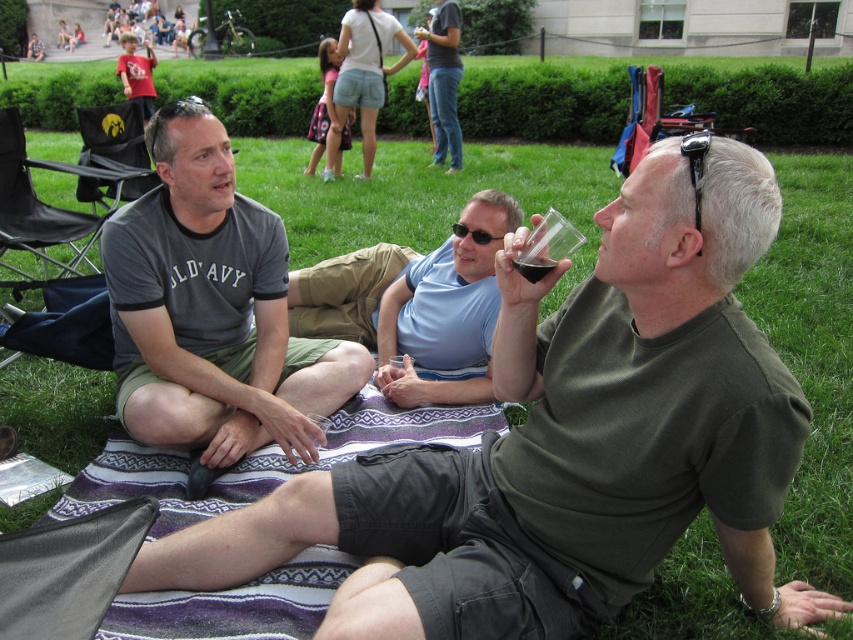
Based on the coordinates provided, which object is located at point (596, 422)?

The point (596, 422) corresponds to the matte green t shirt at center.

You are a photographer standing at the edge of the grassy area. You want to take a photo of the black rubber sunglasses at upper right and the dark glass at center. Which object should you focus on first to ensure both are in sharp focus?

The black rubber sunglasses at upper right is closer to the viewer than the dark glass at center. To ensure both are in sharp focus, you should focus on the dark glass at center since it is farther away, allowing the depth of field to cover both objects.